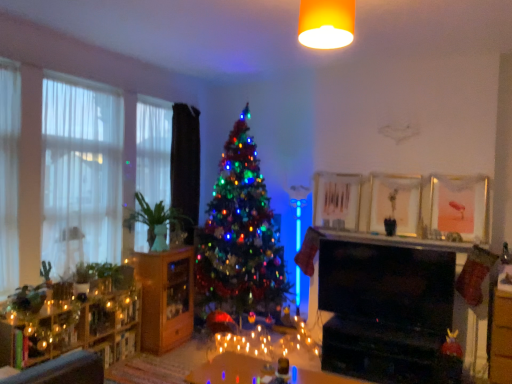
Image resolution: width=512 pixels, height=384 pixels. Identify the location of free spot above pink matte picture frame at upper right, placed as the first picture frame when sorted from right to left (from a real-world perspective). click(456, 167).